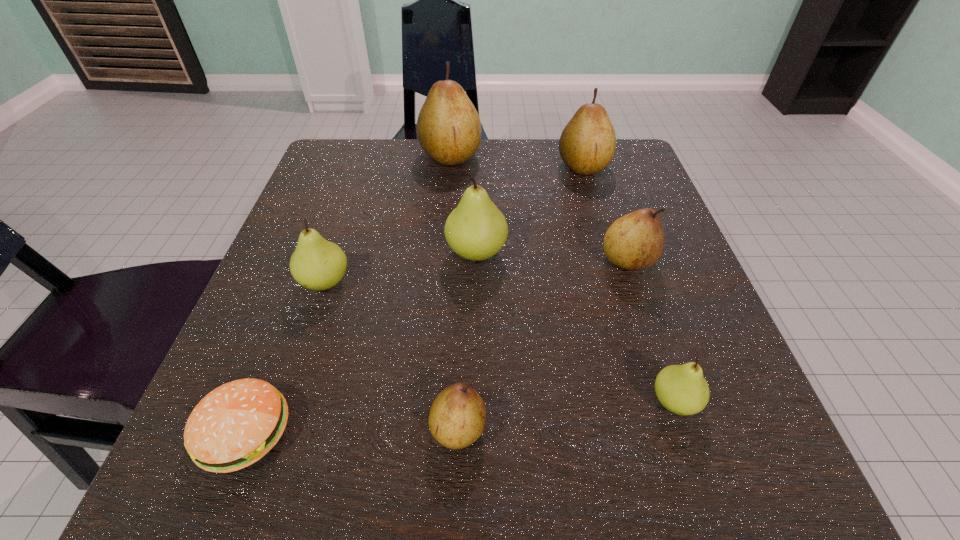
Find the location of a particular element. The width and height of the screenshot is (960, 540). pear located in the near edge section of the desktop is located at coordinates (457, 418).

At what (x,y) coordinates should I click in order to perform the action: click on patty located in the near edge section of the desktop. Please return your answer as a coordinate pair (x, y). This screenshot has width=960, height=540. Looking at the image, I should click on (235, 425).

You are a GUI agent. You are given a task and a screenshot of the screen. Output one action in this format:
    pyautogui.click(x=<x>, y=<y>)
    Task: Click on the pear that is at the left edge
    This screenshot has width=960, height=540.
    Given the screenshot: What is the action you would take?
    pyautogui.click(x=317, y=264)

At what (x,y) coordinates should I click in order to perform the action: click on patty at the left edge. Please return your answer as a coordinate pair (x, y). The height and width of the screenshot is (540, 960). Looking at the image, I should click on (235, 425).

The image size is (960, 540). In order to click on object located in the near left corner section of the desktop in this screenshot , I will do pos(235,425).

You are a GUI agent. You are given a task and a screenshot of the screen. Output one action in this format:
    pyautogui.click(x=<x>, y=<y>)
    Task: Click on the object at the far right corner
    
    Given the screenshot: What is the action you would take?
    pyautogui.click(x=587, y=144)

Find the location of a particular element. The height and width of the screenshot is (540, 960). free space at the far edge is located at coordinates (561, 188).

In the image, there is a desktop. At what (x,y) coordinates should I click in order to perform the action: click on vacant area at the near edge. Please return your answer as a coordinate pair (x, y). This screenshot has height=540, width=960. Looking at the image, I should click on (314, 500).

I want to click on vacant space at the left edge, so click(x=345, y=308).

You are a GUI agent. You are given a task and a screenshot of the screen. Output one action in this format:
    pyautogui.click(x=<x>, y=<y>)
    Task: Click on the vacant space at the right edge of the desktop
    The image size is (960, 540).
    Given the screenshot: What is the action you would take?
    pyautogui.click(x=675, y=363)